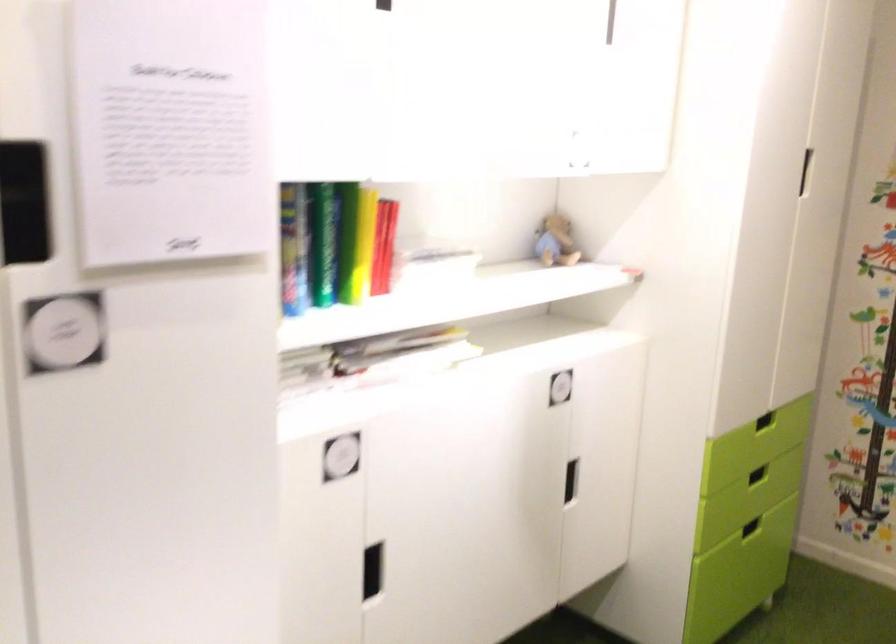
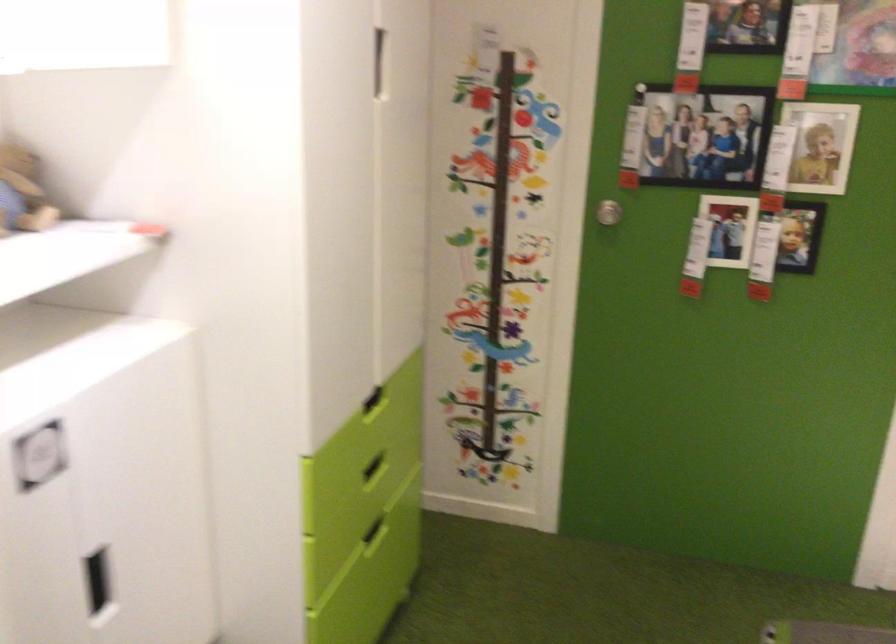
In the second image, find the point that corresponds to (554,242) in the first image.

(22, 192)